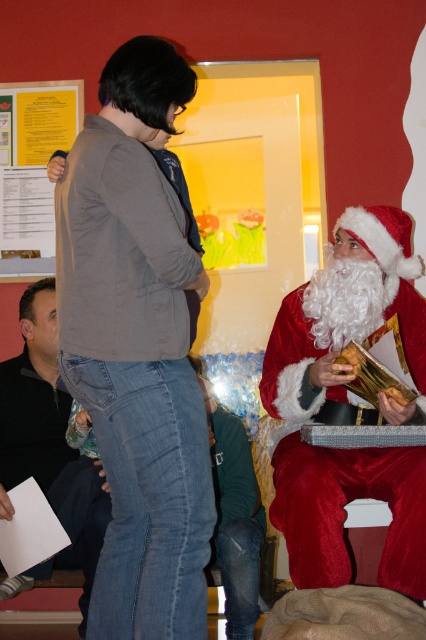
Question: Which point is closer to the camera taking this photo?

Choices:
 (A) (371, 332)
 (B) (48, 284)
 (C) (39, 147)

Answer: (A)

Question: Among these points, which one is nearest to the camera?

Choices:
 (A) (172, 113)
 (B) (34, 419)
 (C) (420, 296)

Answer: (A)

Question: Is velvet red santa at right bigger than dark gray sweater at lower left?

Choices:
 (A) no
 (B) yes

Answer: (A)

Question: Which of the following is the farthest from the observer?

Choices:
 (A) (354, 397)
 (B) (5, 467)

Answer: (B)

Question: Is denim jeans at center to the left of dark gray sweater at lower left from the viewer's perspective?

Choices:
 (A) yes
 (B) no

Answer: (B)

Question: Is denim jeans at center wider than dark gray sweater at lower left?

Choices:
 (A) yes
 (B) no

Answer: (B)